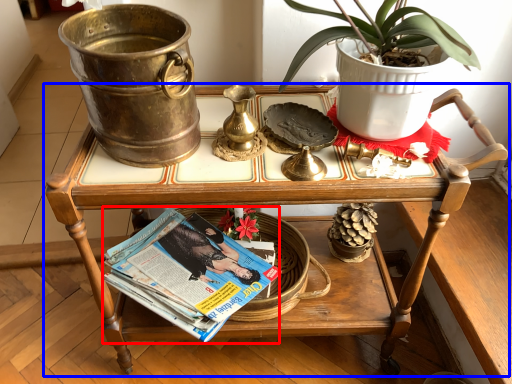
Question: Which object appears closest to the camera in this image, magazine (highlighted by a red box) or table (highlighted by a blue box)?

Choices:
 (A) magazine
 (B) table

Answer: (B)